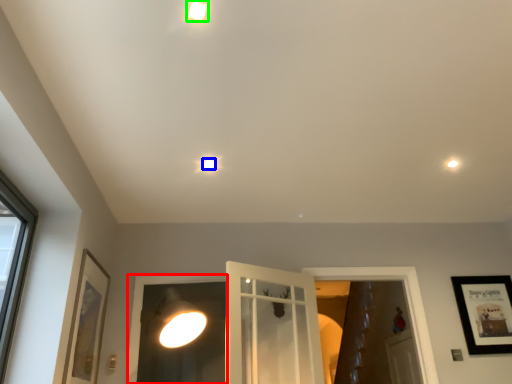
Question: Which object is positioned farthest from window frame (highlighted by a red box)? Select from droplight (highlighted by a blue box) and droplight (highlighted by a green box).

Choices:
 (A) droplight
 (B) droplight

Answer: (B)